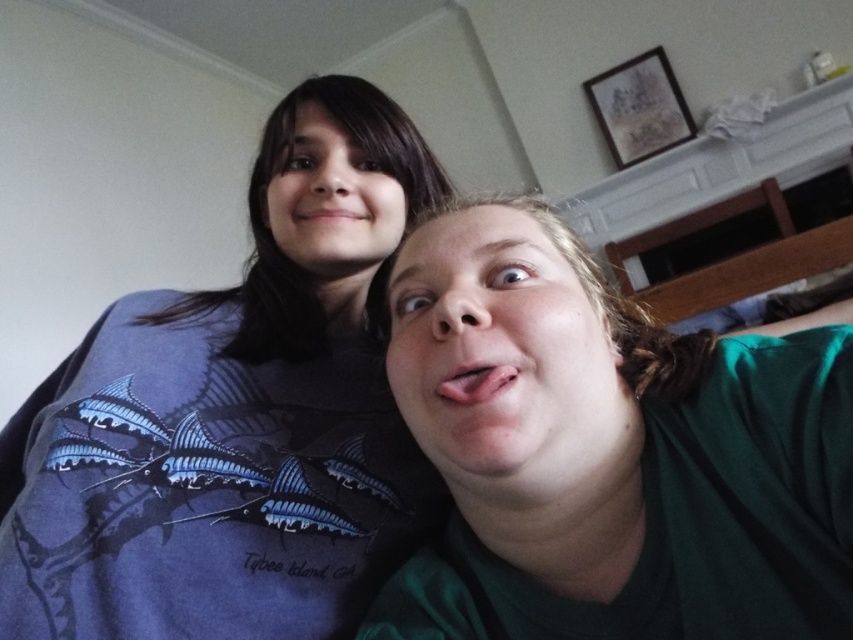
You are standing in front of a photo of two people. The photo has a point marked at coordinates (234, 417). Based on the scene description, which object in the image does this point most likely correspond to?

The point at coordinates (234, 417) corresponds to the blue matte shirt at upper left.